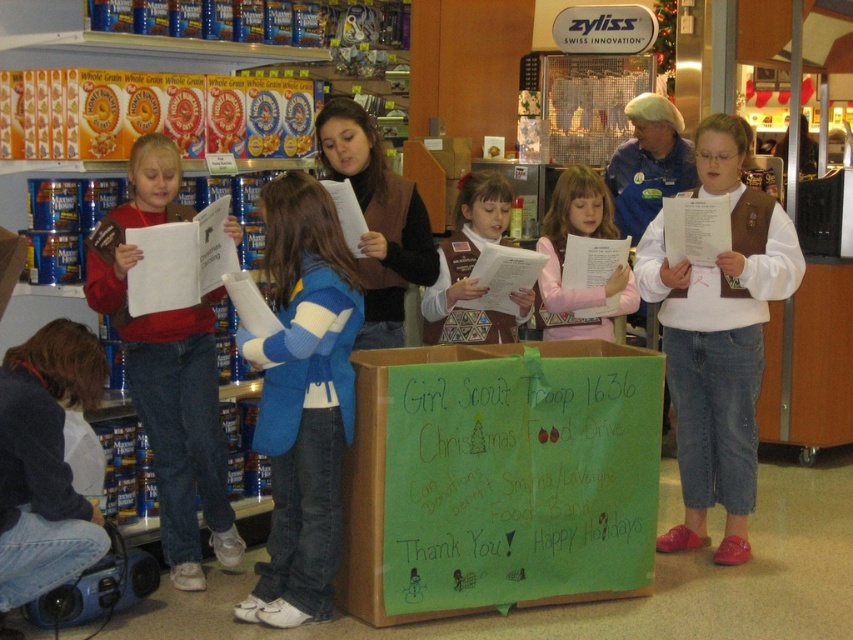
Question: Which point appears closest to the camera in this image?

Choices:
 (A) click(202, 376)
 (B) click(404, 577)
 (C) click(268, 387)
 (D) click(561, 324)

Answer: (C)

Question: Is blue fleece vest at center to the right of pink fleece vest at center from the viewer's perspective?

Choices:
 (A) no
 (B) yes

Answer: (A)

Question: Can you confirm if green cardboard box at center is positioned above pink fleece vest at center?

Choices:
 (A) no
 (B) yes

Answer: (A)

Question: Is matte brown vest at left above pink fleece vest at center?

Choices:
 (A) no
 (B) yes

Answer: (A)

Question: Which point appears closest to the camera in this image?

Choices:
 (A) (161, 531)
 (B) (549, 529)
 (C) (567, 189)
 (D) (469, 292)

Answer: (B)

Question: Estimate the real-world distances between objects in this image. Which object is closer to the matte brown vest at left?

Choices:
 (A) green cardboard box at center
 (B) blue fleece vest at center
 (C) brown uniform vest at center

Answer: (B)